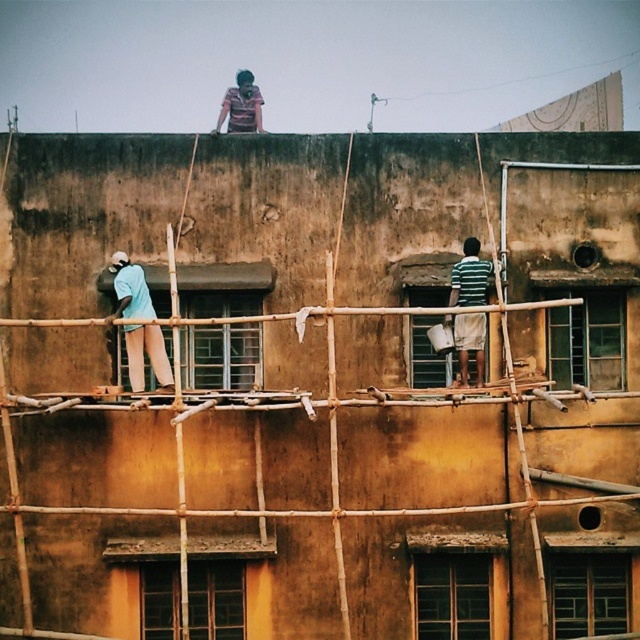
Which of these two, striped cotton shirt at center or striped fabric shirt at upper center, stands taller?

striped fabric shirt at upper center is taller.

Which is below, striped cotton shirt at center or striped fabric shirt at upper center?

striped cotton shirt at center is lower down.

Between point (480, 248) and point (260, 129), which one is positioned behind?

The point (260, 129) is more distant.

You are a GUI agent. You are given a task and a screenshot of the screen. Output one action in this format:
    pyautogui.click(x=<x>, y=<y>)
    Task: Click on the striped cotton shirt at center
    
    Given the screenshot: What is the action you would take?
    pyautogui.click(x=468, y=276)

Consider the image. Can you confirm if light blue fabric at left is smaller than striped fabric shirt at upper center?

Yes.

Who is shorter, light blue fabric at left or striped fabric shirt at upper center?

light blue fabric at left is shorter.

Is point (161, 339) closer to camera compared to point (230, 92)?

Yes, point (161, 339) is closer to viewer.

Locate an element on the screen. The height and width of the screenshot is (640, 640). light blue fabric at left is located at coordinates (147, 356).

Can you confirm if light blue fabric at left is thinner than striped cotton shirt at center?

No.

Does light blue fabric at left appear under striped cotton shirt at center?

Yes, light blue fabric at left is below striped cotton shirt at center.

Who is more forward, (129,339) or (458,332)?

Positioned in front is point (458,332).

You are a GUI agent. You are given a task and a screenshot of the screen. Output one action in this format:
    pyautogui.click(x=<x>, y=<y>)
    Task: Click on the light blue fabric at left
    
    Given the screenshot: What is the action you would take?
    pyautogui.click(x=147, y=356)